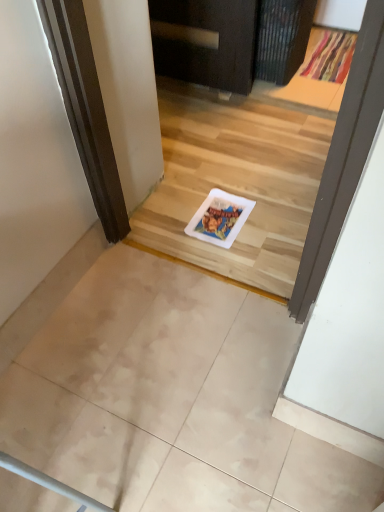
Question: From the image's perspective, does matte beige tile at lower left appear higher than textured fabric doormat at upper right?

Choices:
 (A) no
 (B) yes

Answer: (A)

Question: From the image's perspective, is matte beige tile at lower left below textured fabric doormat at upper right?

Choices:
 (A) no
 (B) yes

Answer: (B)

Question: Can you confirm if matte beige tile at lower left is taller than textured fabric doormat at upper right?

Choices:
 (A) no
 (B) yes

Answer: (B)

Question: Does matte beige tile at lower left have a greater width compared to textured fabric doormat at upper right?

Choices:
 (A) yes
 (B) no

Answer: (B)

Question: Is textured fabric doormat at upper right located within matte beige tile at lower left?

Choices:
 (A) yes
 (B) no

Answer: (B)

Question: Considering the relative positions of matte beige tile at lower left and textured fabric doormat at upper right in the image provided, is matte beige tile at lower left to the left of textured fabric doormat at upper right from the viewer's perspective?

Choices:
 (A) yes
 (B) no

Answer: (A)

Question: Is textured fabric doormat at upper right next to matte beige tile at lower left?

Choices:
 (A) no
 (B) yes

Answer: (A)

Question: Is textured fabric doormat at upper right aimed at matte beige tile at lower left?

Choices:
 (A) no
 (B) yes

Answer: (A)

Question: Is textured fabric doormat at upper right positioned with its back to matte beige tile at lower left?

Choices:
 (A) yes
 (B) no

Answer: (B)

Question: From the image's perspective, is textured fabric doormat at upper right beneath matte beige tile at lower left?

Choices:
 (A) no
 (B) yes

Answer: (A)

Question: Could matte beige tile at lower left be considered to be inside textured fabric doormat at upper right?

Choices:
 (A) yes
 (B) no

Answer: (B)

Question: Would you say textured fabric doormat at upper right is a long distance from matte beige tile at lower left?

Choices:
 (A) yes
 (B) no

Answer: (A)

Question: From a real-world perspective, is textured fabric doormat at upper right above or below matte beige tile at lower left?

Choices:
 (A) above
 (B) below

Answer: (B)